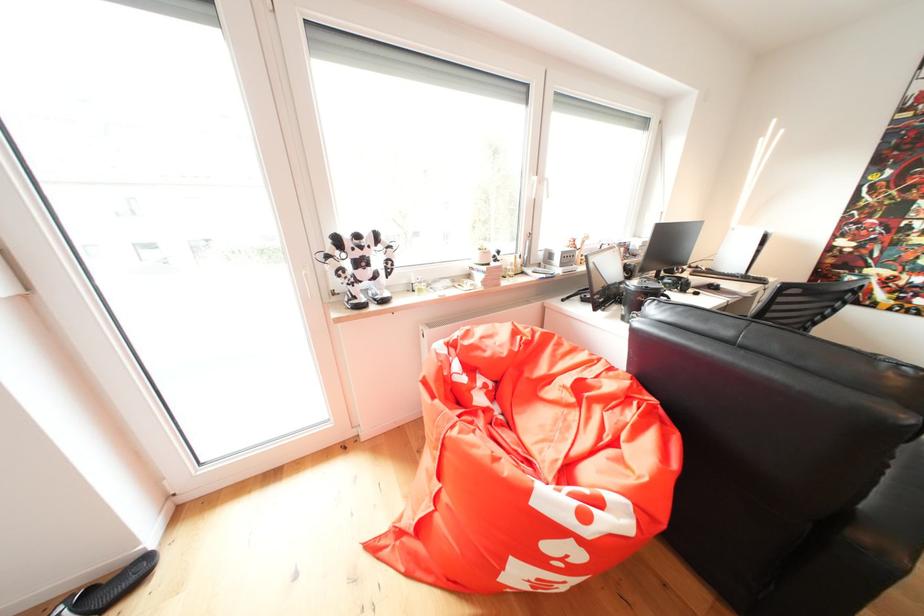
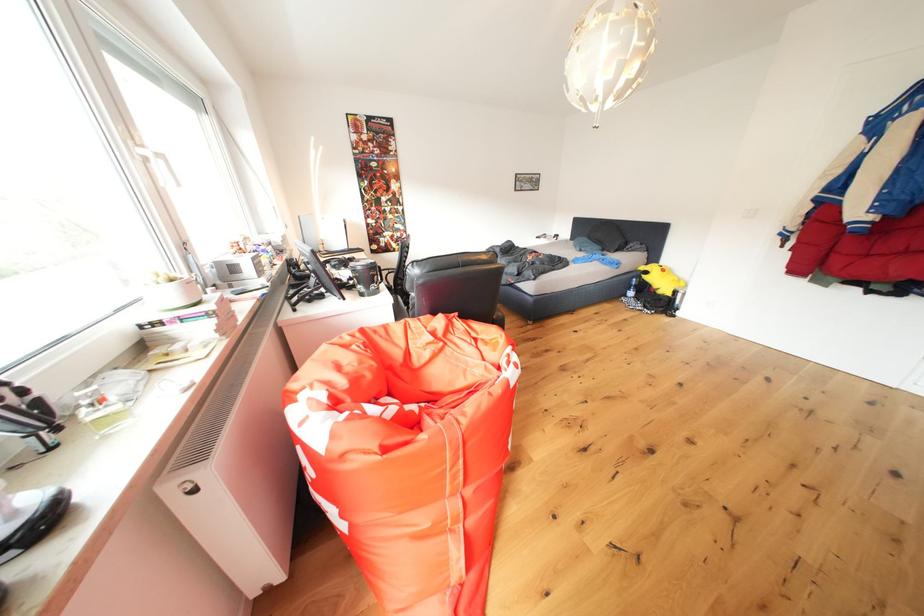
Locate, in the second image, the point that corresponds to (x=640, y=293) in the first image.

(369, 273)